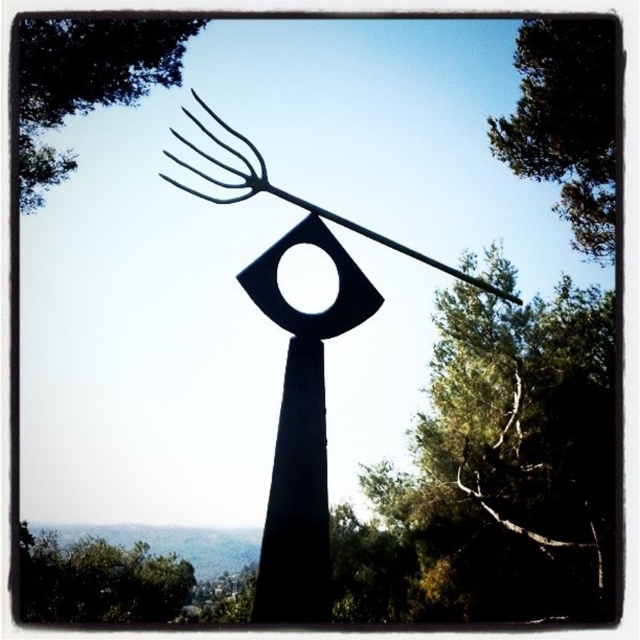
Question: Does green leafy tree at upper center come behind green leafy tree at upper right?

Choices:
 (A) yes
 (B) no

Answer: (A)

Question: Among these points, which one is farthest from the camera?

Choices:
 (A) (154, 556)
 (B) (29, 140)
 (C) (595, 109)
 (D) (445, 541)

Answer: (D)

Question: Is green leafy tree at upper right above green leafy tree at lower left?

Choices:
 (A) no
 (B) yes

Answer: (B)

Question: Which of the following is the farthest from the observer?

Choices:
 (A) green leafy tree at upper left
 (B) green leafy tree at upper center
 (C) green leafy tree at upper right
 (D) green leafy tree at lower left

Answer: (B)

Question: Is green leafy tree at upper center further to camera compared to green leafy tree at lower left?

Choices:
 (A) yes
 (B) no

Answer: (A)

Question: Which point is farther from the camera taking this photo?

Choices:
 (A) (106, 566)
 (B) (557, 80)

Answer: (A)